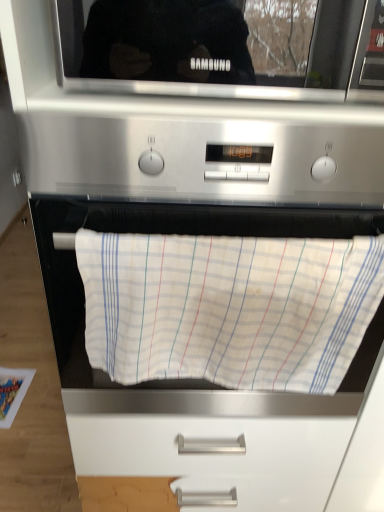
Question: Based on their positions, is black glossy microwave at upper center located to the left or right of white cotton towel at center?

Choices:
 (A) right
 (B) left

Answer: (A)

Question: In terms of size, does black glossy microwave at upper center appear bigger or smaller than white cotton towel at center?

Choices:
 (A) small
 (B) big

Answer: (B)

Question: From the image's perspective, is black glossy microwave at upper center located above or below white cotton towel at center?

Choices:
 (A) above
 (B) below

Answer: (A)

Question: In terms of size, does white cotton towel at center appear bigger or smaller than black glossy microwave at upper center?

Choices:
 (A) big
 (B) small

Answer: (B)

Question: Considering the positions of point (188, 321) and point (259, 48), is point (188, 321) closer or farther from the camera than point (259, 48)?

Choices:
 (A) closer
 (B) farther

Answer: (B)

Question: Is white cotton towel at center inside or outside of black glossy microwave at upper center?

Choices:
 (A) inside
 (B) outside

Answer: (B)

Question: From the image's perspective, is white cotton towel at center above or below black glossy microwave at upper center?

Choices:
 (A) below
 (B) above

Answer: (A)